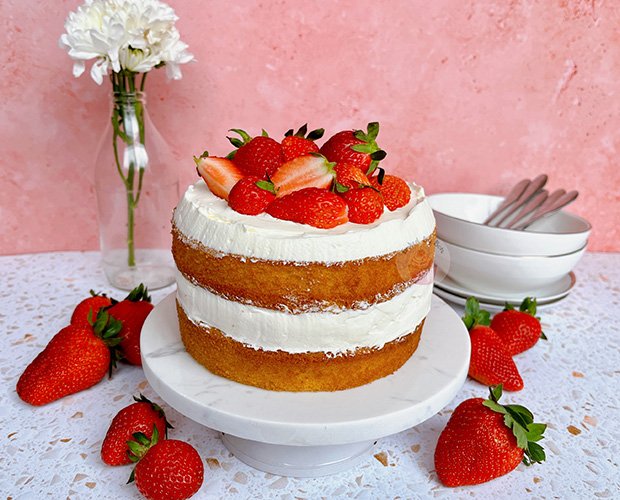
This screenshot has height=500, width=620. Find the location of `doily`. doily is located at coordinates (42, 448).